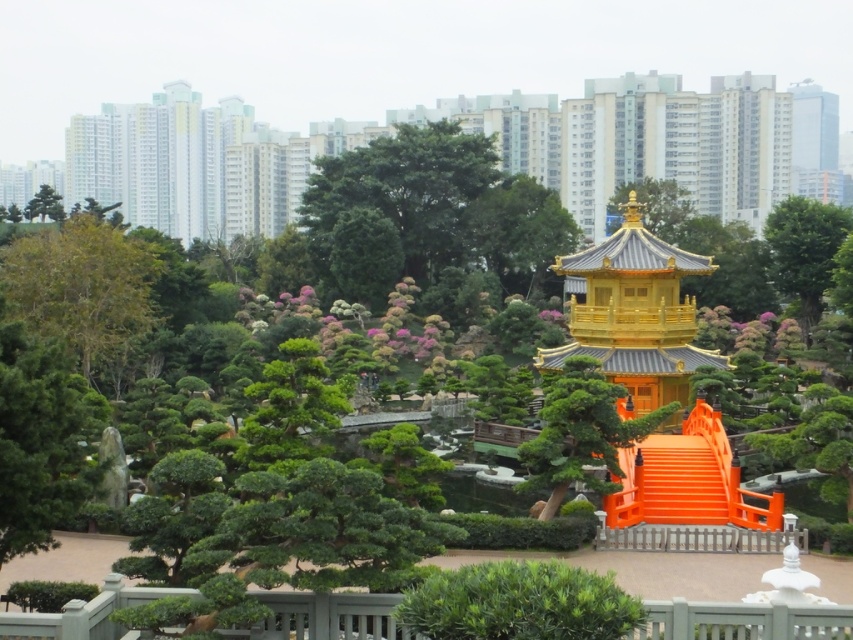
Looking at this image, which of these two, green leafy tree at left or green matte tree at upper left, stands taller?

With more height is green matte tree at upper left.

Can you confirm if green leafy tree at left is positioned above green matte tree at upper left?

No, green leafy tree at left is not above green matte tree at upper left.

The height and width of the screenshot is (640, 853). I want to click on green leafy tree at left, so click(80, 285).

Who is taller, golden polished wood gazebo at center or green matte tree at center?

Standing taller between the two is golden polished wood gazebo at center.

Who is shorter, golden polished wood gazebo at center or green matte tree at center?

Standing shorter between the two is green matte tree at center.

Does point (592, 332) lie in front of point (583, 396)?

No, it is behind (583, 396).

Find the location of a particular element. The image size is (853, 640). golden polished wood gazebo at center is located at coordinates (635, 316).

Can you confirm if green leafy bush at center is positioned to the right of green matte tree at center?

Incorrect, green leafy bush at center is not on the right side of green matte tree at center.

Which of these two, green leafy bush at center or green matte tree at center, stands shorter?

green leafy bush at center is shorter.

Is point (434, 593) more distant than point (556, 436)?

That is False.

Find the location of a particular element. This screenshot has width=853, height=640. green leafy bush at center is located at coordinates (518, 602).